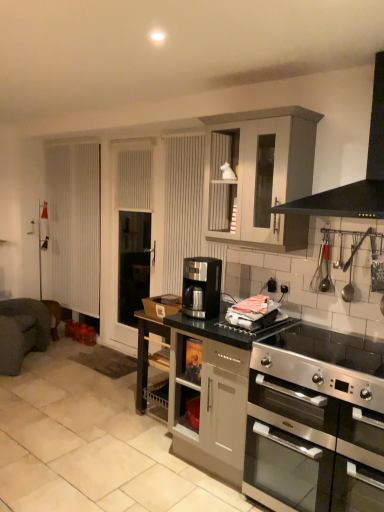
What do you see at coordinates (75, 225) in the screenshot? I see `white vertical blinds at left` at bounding box center [75, 225].

Measure the distance between matte gray cabinet at center, which is counted as the 1th cabinetry, starting from the bottom, and camera.

The distance of matte gray cabinet at center, which is counted as the 1th cabinetry, starting from the bottom, from camera is 2.27 meters.

Image resolution: width=384 pixels, height=512 pixels. Describe the element at coordinates (211, 391) in the screenshot. I see `matte gray cabinet at center, which ranks as the second cabinetry in top-to-bottom order` at that location.

What do you see at coordinates (269, 175) in the screenshot? The image size is (384, 512). I see `white matte cabinet at upper center, which appears as the first cabinetry when viewed from the top` at bounding box center [269, 175].

The image size is (384, 512). I want to click on white matte cabinet at upper center, which appears as the first cabinetry when viewed from the top, so click(x=269, y=175).

Identify the location of white vertical blinds at left. The image size is (384, 512). (75, 225).

Measure the distance from satin black coffee machine at center to white vertical blinds at left.

The distance of satin black coffee machine at center from white vertical blinds at left is 8.20 feet.

Which object is positioned more to the left, satin black coffee machine at center or white vertical blinds at left?

Positioned to the left is white vertical blinds at left.

The image size is (384, 512). I want to click on coffee machine lying on the right of white vertical blinds at left, so click(x=201, y=287).

Would you say matte black countertop at center is inside or outside stainless steel gas stove at lower right?

matte black countertop at center cannot be found inside stainless steel gas stove at lower right.

In the scene shown: What's the angular difference between matte black countertop at center and stainless steel gas stove at lower right's facing directions?

90.5 degrees separate the facing orientations of matte black countertop at center and stainless steel gas stove at lower right.

In terms of width, does matte black countertop at center look wider or thinner when compared to stainless steel gas stove at lower right?

In the image, matte black countertop at center appears to be wider than stainless steel gas stove at lower right.

Considering the sizes of objects white matte cabinet at upper center, which appears as the first cabinetry when viewed from the top, and stainless steel oven at lower right in the image provided, who is wider, white matte cabinet at upper center, which appears as the first cabinetry when viewed from the top, or stainless steel oven at lower right?

stainless steel oven at lower right.

From the image's perspective, relative to stainless steel oven at lower right, is white matte cabinet at upper center, which appears as the first cabinetry when viewed from the top, above or below?

Clearly, from the image's perspective, white matte cabinet at upper center, which appears as the first cabinetry when viewed from the top, is above stainless steel oven at lower right.

Identify the location of oven that is under the white matte cabinet at upper center, which appears as the first cabinetry when viewed from the top (from a real-world perspective). (312, 435).

What's the angular difference between white matte cabinet at upper center, acting as the 2th cabinetry starting from the bottom, and stainless steel oven at lower right's facing directions?

white matte cabinet at upper center, acting as the 2th cabinetry starting from the bottom, and stainless steel oven at lower right are facing 0.811 degrees away from each other.

From the stainless steel oven at lower right, count the 2nd cabinetry to the left and point to it. Please provide its 2D coordinates.

[(211, 391)]

From the image's perspective, which object appears higher, matte gray cabinet at center, which ranks as the second cabinetry in top-to-bottom order, or stainless steel oven at lower right?

matte gray cabinet at center, which ranks as the second cabinetry in top-to-bottom order, from the image's perspective.

In the scene shown: Is the surface of matte gray cabinet at center, which is counted as the 1th cabinetry, starting from the bottom, in direct contact with stainless steel oven at lower right?

No, matte gray cabinet at center, which is counted as the 1th cabinetry, starting from the bottom, is not next to stainless steel oven at lower right.

Can you tell me how much matte gray cabinet at center, which ranks as the second cabinetry in top-to-bottom order, and stainless steel oven at lower right differ in facing direction?

They differ by 0.0352 degrees in their facing directions.

Who is more distant, matte black countertop at center or stainless steel oven at lower right?

stainless steel oven at lower right is more distant.

Can you tell me how much matte black countertop at center and stainless steel oven at lower right differ in facing direction?

The angle between the facing direction of matte black countertop at center and the facing direction of stainless steel oven at lower right is 90.3 degrees.

Is matte black countertop at center inside the boundaries of stainless steel oven at lower right, or outside?

matte black countertop at center lies outside stainless steel oven at lower right.

Are satin black coffee machine at center and dark gray fabric armchair at left making contact?

They are not placed beside each other.

Is the position of satin black coffee machine at center more distant than that of dark gray fabric armchair at left?

No.

From the image's perspective, is satin black coffee machine at center under dark gray fabric armchair at left?

No, from the image's perspective, satin black coffee machine at center is not beneath dark gray fabric armchair at left.

How much distance is there between satin black coffee machine at center and dark gray fabric armchair at left?

2.05 meters.

Is white matte cabinet at upper center, which appears as the first cabinetry when viewed from the top, at the right side of black matte range hood at upper right?

No.

Which is behind, white matte cabinet at upper center, which appears as the first cabinetry when viewed from the top, or black matte range hood at upper right?

white matte cabinet at upper center, which appears as the first cabinetry when viewed from the top, is more distant.

Is white matte cabinet at upper center, which appears as the first cabinetry when viewed from the top, positioned far away from black matte range hood at upper right?

No, white matte cabinet at upper center, which appears as the first cabinetry when viewed from the top, is not far away from black matte range hood at upper right.

The image size is (384, 512). Identify the location of screen door located behind the satin black coffee machine at center. (75, 225).

Find the location of a particular element. gas stove above the matte black countertop at center (from the image's perspective) is located at coordinates (331, 348).

From the image, which object appears to be nearer to stainless steel gas stove at lower right, stainless steel oven at lower right or satin black coffee machine at center?

stainless steel oven at lower right lies closer to stainless steel gas stove at lower right than the other object.

Looking at the image, which one is located further to white matte cabinet at upper center, acting as the 2th cabinetry starting from the bottom, stainless steel oven at lower right or stainless steel gas stove at lower right?

stainless steel oven at lower right is positioned further to the anchor white matte cabinet at upper center, acting as the 2th cabinetry starting from the bottom.

When comparing their distances from stainless steel gas stove at lower right, does white vertical blinds at left or black matte range hood at upper right seem further?

white vertical blinds at left lies further to stainless steel gas stove at lower right than the other object.

Looking at the image, which one is located further to satin black coffee machine at center, dark gray fabric armchair at left or matte gray cabinet at center, which ranks as the second cabinetry in top-to-bottom order?

dark gray fabric armchair at left is further to satin black coffee machine at center.

Estimate the real-world distances between objects in this image. Which object is closer to white vertical blinds at left, black matte range hood at upper right or matte gray cabinet at center, which ranks as the second cabinetry in top-to-bottom order?

matte gray cabinet at center, which ranks as the second cabinetry in top-to-bottom order, lies closer to white vertical blinds at left than the other object.

Considering their positions, is white vertical blinds at left positioned closer to white matte cabinet at upper center, which appears as the first cabinetry when viewed from the top, than black matte range hood at upper right?

The object closer to white matte cabinet at upper center, which appears as the first cabinetry when viewed from the top, is black matte range hood at upper right.

Looking at the image, which one is located further to stainless steel oven at lower right, dark gray fabric armchair at left or black matte range hood at upper right?

dark gray fabric armchair at left lies further to stainless steel oven at lower right than the other object.

When comparing their distances from matte black countertop at center, does black matte range hood at upper right or white matte cabinet at upper center, which appears as the first cabinetry when viewed from the top, seem closer?

white matte cabinet at upper center, which appears as the first cabinetry when viewed from the top, is closer to matte black countertop at center.

Identify the location of coffee machine that lies between black matte range hood at upper right and stainless steel oven at lower right from top to bottom. The image size is (384, 512). coord(201,287).

This screenshot has width=384, height=512. Find the location of `oven between black matte range hood at upper right and matte black countertop at center in the up-down direction`. oven between black matte range hood at upper right and matte black countertop at center in the up-down direction is located at coordinates (312, 435).

Find the location of a particular element. Image resolution: width=384 pixels, height=512 pixels. armchair positioned between stainless steel oven at lower right and white vertical blinds at left from near to far is located at coordinates (21, 332).

The height and width of the screenshot is (512, 384). Find the location of `counter situated between dark gray fabric armchair at left and stainless steel gas stove at lower right from left to right`. counter situated between dark gray fabric armchair at left and stainless steel gas stove at lower right from left to right is located at coordinates (280, 410).